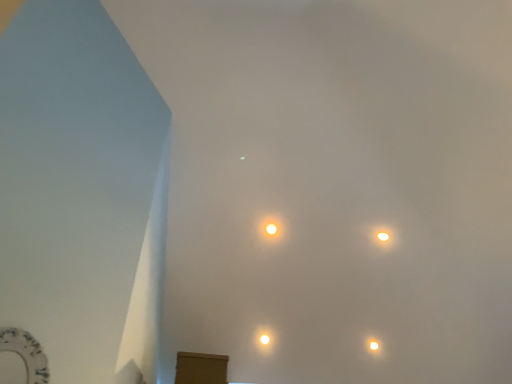
Question: Does white glossy lamp at upper right, which is counted as the 3th lamp, starting from the left, lie behind white glossy lamp at center, the 3th lamp positioned from the top?

Choices:
 (A) yes
 (B) no

Answer: (B)

Question: Is white glossy lamp at upper right, the first lamp viewed from the right, to the right of white glossy lamp at center, which is counted as the 1th lamp, starting from the left, from the viewer's perspective?

Choices:
 (A) no
 (B) yes

Answer: (B)

Question: Is white glossy lamp at upper right, the second lamp positioned from the bottom, outside of white glossy lamp at center, the first lamp ordered from the bottom?

Choices:
 (A) yes
 (B) no

Answer: (A)

Question: From the image's perspective, is white glossy lamp at upper right, which is counted as the 3th lamp, starting from the left, beneath white glossy lamp at center, the 3th lamp positioned from the top?

Choices:
 (A) yes
 (B) no

Answer: (B)

Question: Is white glossy lamp at upper right, the second lamp positioned from the bottom, thinner than white glossy lamp at center, the first lamp ordered from the bottom?

Choices:
 (A) no
 (B) yes

Answer: (B)

Question: In terms of width, does white glossy lamp at center, positioned as the third lamp in right-to-left order, look wider or thinner when compared to white glossy lamp at upper right, which is counted as the 3th lamp, starting from the left?

Choices:
 (A) thin
 (B) wide

Answer: (B)

Question: Considering the relative positions of white glossy lamp at center, the 3th lamp positioned from the top, and white glossy lamp at upper right, which is counted as the 3th lamp, starting from the left, in the image provided, is white glossy lamp at center, the 3th lamp positioned from the top, to the left or to the right of white glossy lamp at upper right, which is counted as the 3th lamp, starting from the left,?

Choices:
 (A) left
 (B) right

Answer: (A)

Question: From the image's perspective, is white glossy lamp at center, the first lamp ordered from the bottom, located above or below white glossy lamp at upper right, which is counted as the 3th lamp, starting from the left?

Choices:
 (A) above
 (B) below

Answer: (B)

Question: Looking at the image, does white glossy lamp at center, positioned as the third lamp in right-to-left order, seem bigger or smaller compared to white glossy lamp at upper right, which is counted as the 3th lamp, starting from the left?

Choices:
 (A) small
 (B) big

Answer: (A)

Question: In terms of width, does white glossy lamp at upper right, the second lamp positioned from the bottom, look wider or thinner when compared to matte yellow light at center, which ranks as the 2th lamp in left-to-right order?

Choices:
 (A) thin
 (B) wide

Answer: (A)

Question: Is white glossy lamp at upper right, which is counted as the 3th lamp, starting from the left, to the left or to the right of matte yellow light at center, which ranks as the 2th lamp in left-to-right order, in the image?

Choices:
 (A) right
 (B) left

Answer: (A)

Question: Does point (379, 236) appear closer or farther from the camera than point (274, 233)?

Choices:
 (A) closer
 (B) farther

Answer: (B)

Question: Is white glossy lamp at upper right, which appears as the second lamp when viewed from the top, in front of or behind matte yellow light at center, which ranks as the 2th lamp in left-to-right order, in the image?

Choices:
 (A) front
 (B) behind

Answer: (B)

Question: Does point (267, 233) appear closer or farther from the camera than point (267, 340)?

Choices:
 (A) farther
 (B) closer

Answer: (B)

Question: From a real-world perspective, is matte yellow light at center, which is the 3th lamp from bottom to top, physically located above or below white glossy lamp at center, the 3th lamp positioned from the top?

Choices:
 (A) above
 (B) below

Answer: (A)